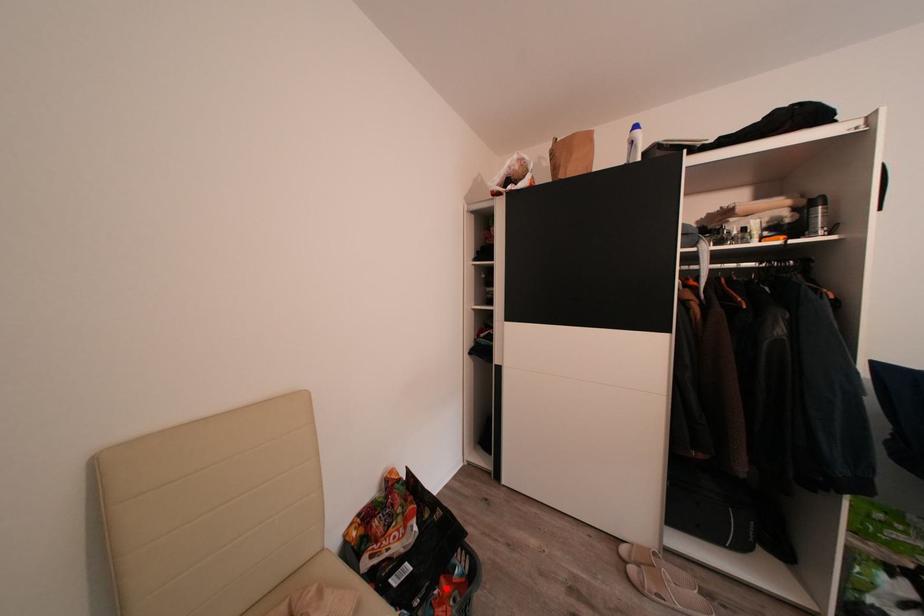
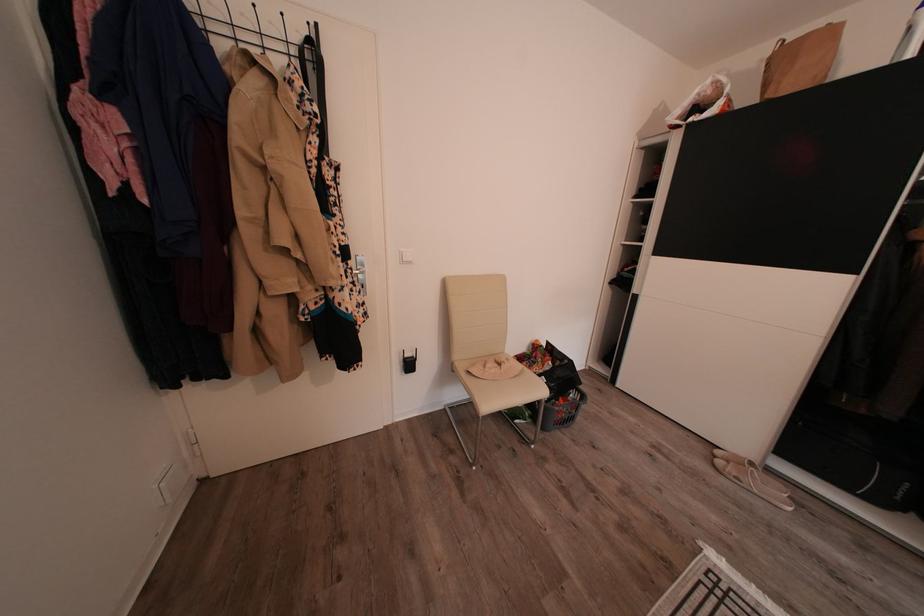
Locate, in the second image, the point that corresponds to the highlighted location in the first image.

(565, 405)